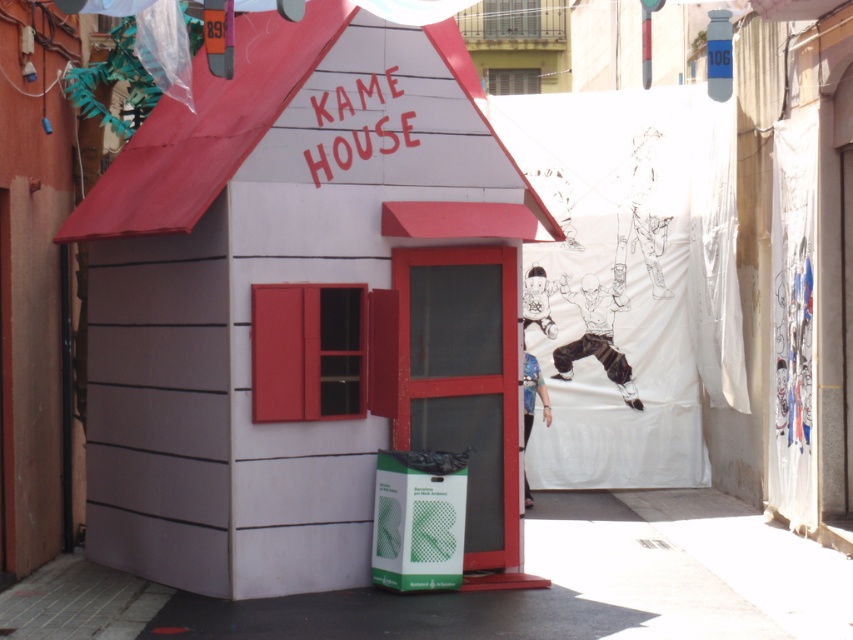
Describe the element at coordinates (300, 308) in the screenshot. I see `matte white house at center` at that location.

Based on the photo, which is above, matte white house at center or white matte hut at center?

white matte hut at center is higher up.

The width and height of the screenshot is (853, 640). Find the location of `matte white house at center`. matte white house at center is located at coordinates (300, 308).

I want to click on matte white house at center, so click(x=300, y=308).